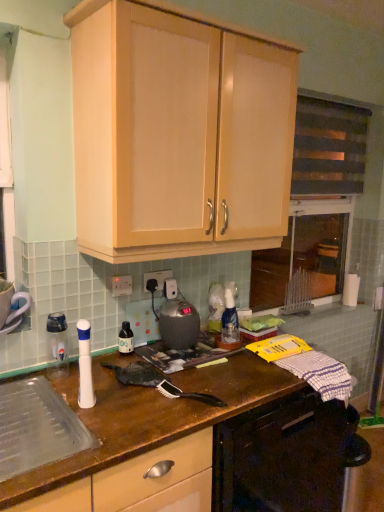
Locate an element on the screen. The image size is (384, 512). vacant space in metallic gray kettle at center (from a real-world perspective) is located at coordinates (183, 345).